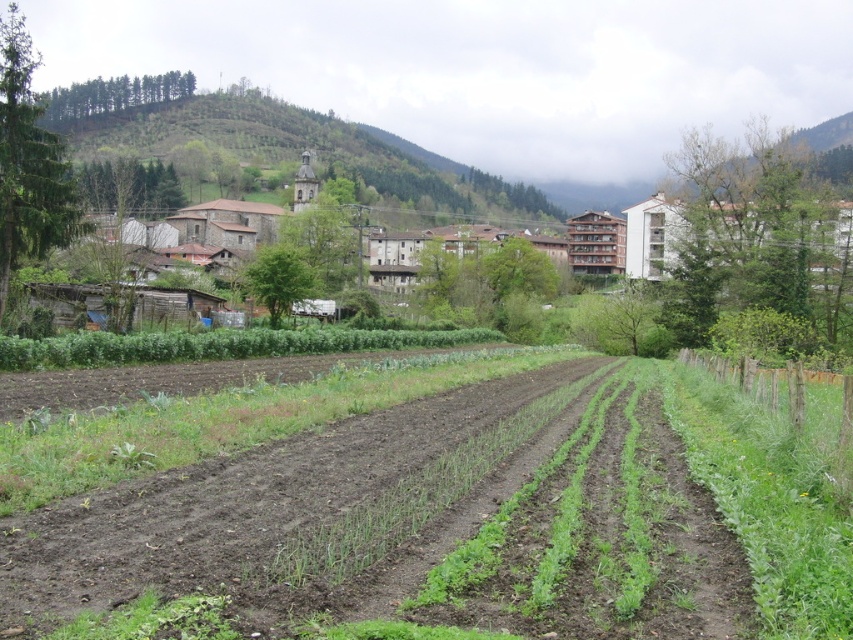
You are standing in the rural landscape and want to take a photo of the brown stone buildings at center and the green forested hillside at upper center. Which one will appear closer to you in the photo?

The brown stone buildings at center will appear closer to you in the photo because they are positioned closer to the viewer compared to the green forested hillside at upper center, which is farther away.

You are standing at the point labeled point [759,221] and want to walk towards the point labeled point [251,104]. Given that the distance between them is 100 meters, and you can walk at a speed of 5 meters per minute, how many minutes will it take you to reach the destination?

The distance between point [759,221] and point [251,104] is 100 meters. At a walking speed of 5 meters per minute, it will take you 20 minutes to reach the destination.

You are a farmer standing in the field and want to determine which structure is closer to you. Based on the scene, which one is smaller in size between the brown stone buildings at center and the green forested hillside at upper center?

The brown stone buildings at center has a smaller size compared to the green forested hillside at upper center, so the brown stone buildings at center is closer to you.